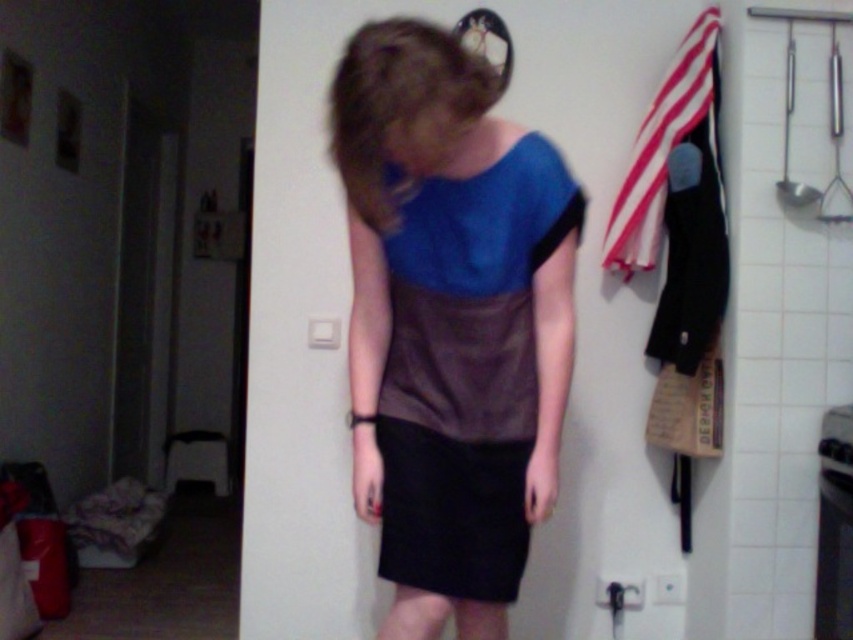
Question: Does matte blue fabric at center appear over red striped fabric at upper right?

Choices:
 (A) yes
 (B) no

Answer: (B)

Question: Is matte blue fabric at center bigger than black matte skirt at center?

Choices:
 (A) yes
 (B) no

Answer: (A)

Question: Considering the real-world distances, which object is closest to the black matte skirt at center?

Choices:
 (A) red striped fabric at upper right
 (B) matte blue fabric at center

Answer: (B)

Question: Can you confirm if matte blue fabric at center is positioned to the right of red striped fabric at upper right?

Choices:
 (A) no
 (B) yes

Answer: (A)

Question: Which is nearer to the matte blue fabric at center?

Choices:
 (A) black matte skirt at center
 (B) red striped fabric at upper right

Answer: (A)

Question: Among these objects, which one is nearest to the camera?

Choices:
 (A) matte blue fabric at center
 (B) black matte skirt at center

Answer: (A)